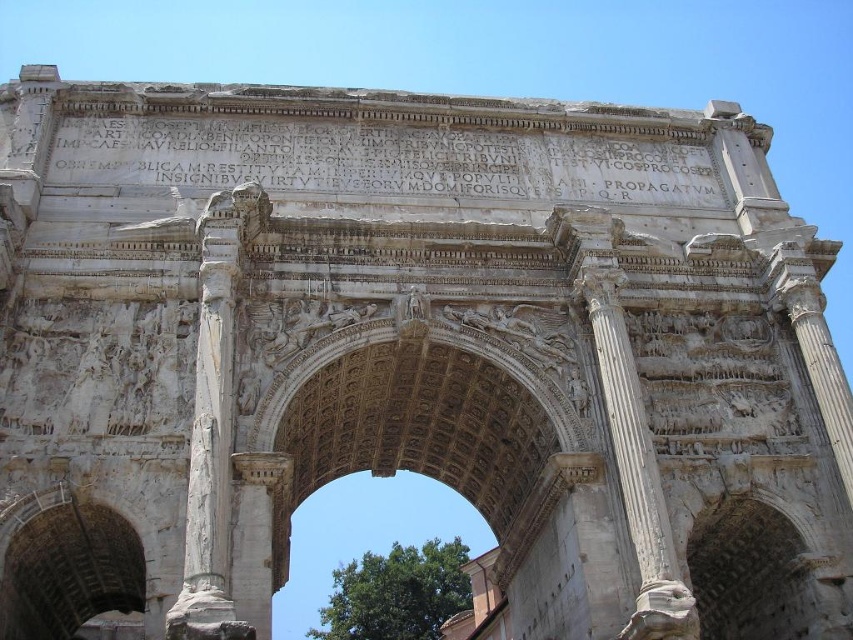
You are an architect examining the Arch of Titus. You notice two columns, the white marble column at left and the white marble column at center. Which column is taller?

The white marble column at left is taller than the white marble column at center according to the description.

You are standing in front of the Arch of Titus and want to take a photo. You notice two points marked on the arch. One is at point coordinates [229,243] and the other at [619,444]. Which point is closer to you when you are facing the arch?

Point [229,243] is closer to you because it is further to the viewer than point [619,444].